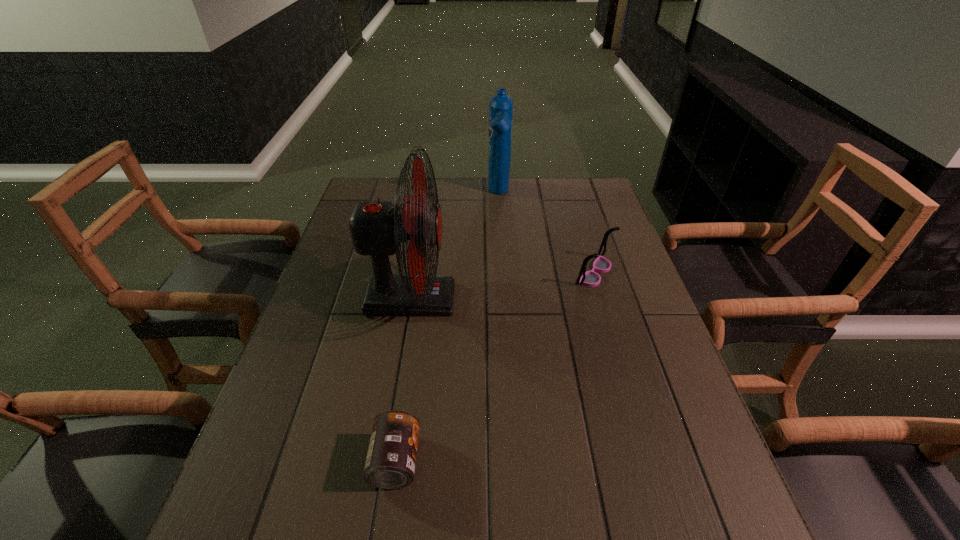
Locate an element on the screen. fan is located at coordinates (377, 228).

Identify the location of the second object from right to left. [500, 105].

Where is `the farthest object`? the farthest object is located at coordinates (500, 105).

Find the location of a particular element. The height and width of the screenshot is (540, 960). the rightmost object is located at coordinates (590, 278).

Find the location of a particular element. the third tallest object is located at coordinates (590, 278).

Where is `can`? Image resolution: width=960 pixels, height=540 pixels. can is located at coordinates (390, 464).

Where is `the nearest object`? Image resolution: width=960 pixels, height=540 pixels. the nearest object is located at coordinates (390, 464).

Where is `blank space located 0.200m on the front-facing side of the fan`? The height and width of the screenshot is (540, 960). blank space located 0.200m on the front-facing side of the fan is located at coordinates (529, 299).

This screenshot has width=960, height=540. What are the coordinates of `free space located on the left of the second tallest object` in the screenshot? It's located at (413, 193).

You are a GUI agent. You are given a task and a screenshot of the screen. Output one action in this format:
    pyautogui.click(x=<x>, y=<y>)
    Task: Click on the free space located 0.200m on the left of the rightmost object
    The height and width of the screenshot is (540, 960).
    Given the screenshot: What is the action you would take?
    pyautogui.click(x=503, y=273)